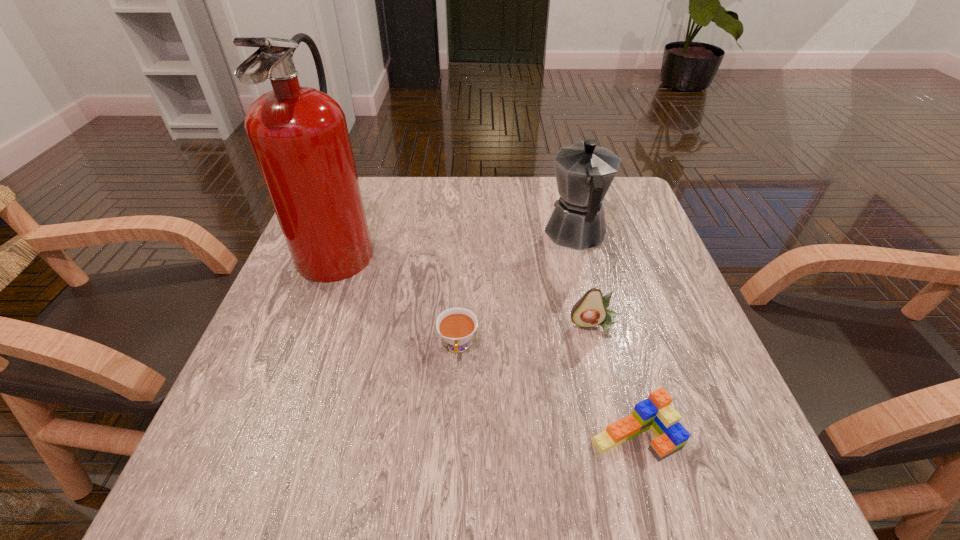
Find the location of a particular element. vacant space that's between the third tallest object and the fourth shortest object is located at coordinates (586, 280).

I want to click on vacant area that lies between the third tallest object and the fire extinguisher, so click(467, 286).

At what (x,y) coordinates should I click in order to perform the action: click on vacant area that lies between the nearest object and the avocado. Please return your answer as a coordinate pair (x, y). This screenshot has height=540, width=960. Looking at the image, I should click on (614, 381).

This screenshot has height=540, width=960. In order to click on empty space between the fire extinguisher and the nearest object in this screenshot , I will do `click(487, 341)`.

This screenshot has width=960, height=540. I want to click on free space between the third shortest object and the Lego, so click(614, 381).

I want to click on free space between the Lego and the fire extinguisher, so click(x=487, y=341).

Identify the location of blank region between the fire extinguisher and the fourth shortest object. The height and width of the screenshot is (540, 960). (457, 240).

Identify the location of unoccupied area between the fourth object from right to left and the nearest object. This screenshot has width=960, height=540. [x=546, y=392].

Locate an element on the screen. This screenshot has height=540, width=960. object that is the second nearest to the Lego is located at coordinates (457, 325).

Identify the location of object identified as the fourth closest to the coffeepot. (299, 136).